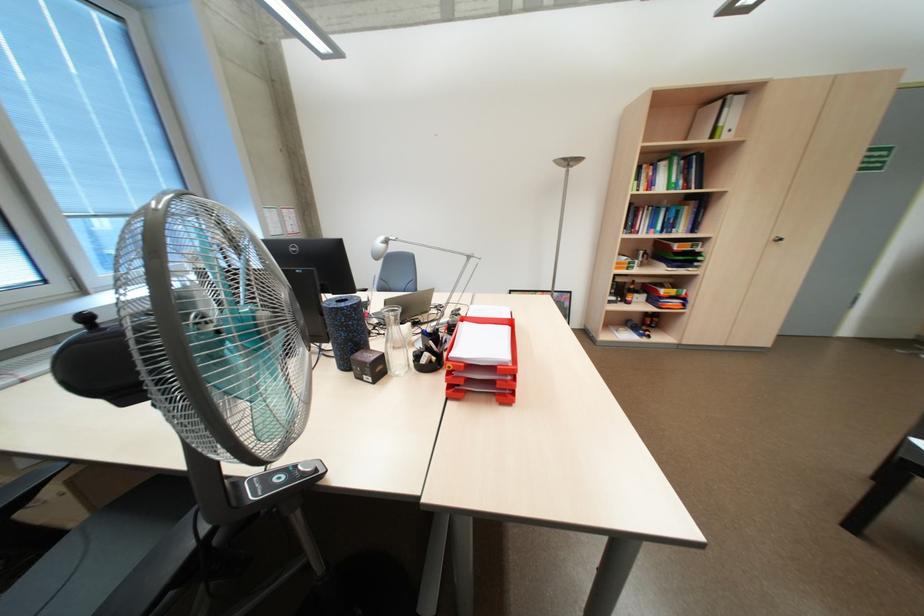
Find the location of a particular element. This screenshot has width=924, height=616. clear glass bottle is located at coordinates (395, 342).